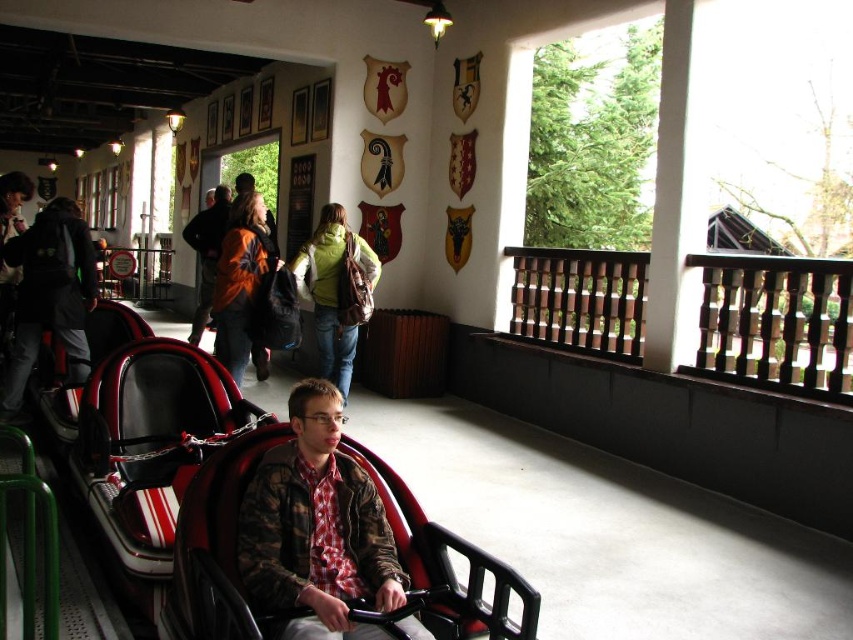
Which is more to the left, matte black backpack at left or green fabric jacket at center?

matte black backpack at left

Is matte black backpack at left thinner than green fabric jacket at center?

No, matte black backpack at left is not thinner than green fabric jacket at center.

The height and width of the screenshot is (640, 853). Identify the location of matte black backpack at left. (50, 296).

Which is below, camouflage-patterned seat at center or matte black backpack at left?

camouflage-patterned seat at center

Can you confirm if camouflage-patterned seat at center is positioned to the left of matte black backpack at left?

No, camouflage-patterned seat at center is not to the left of matte black backpack at left.

The height and width of the screenshot is (640, 853). What are the coordinates of `camouflage-patterned seat at center` in the screenshot? It's located at (216, 547).

Locate an element on the screen. camouflage-patterned seat at center is located at coordinates (216, 547).

Is camouflage jacket at center to the left of camouflage-patterned seat at center from the viewer's perspective?

Indeed, camouflage jacket at center is positioned on the left side of camouflage-patterned seat at center.

Between camouflage jacket at center and camouflage-patterned seat at center, which one appears on the right side from the viewer's perspective?

camouflage-patterned seat at center

The image size is (853, 640). What do you see at coordinates (316, 528) in the screenshot?
I see `camouflage jacket at center` at bounding box center [316, 528].

This screenshot has width=853, height=640. What are the coordinates of `camouflage jacket at center` in the screenshot? It's located at (316, 528).